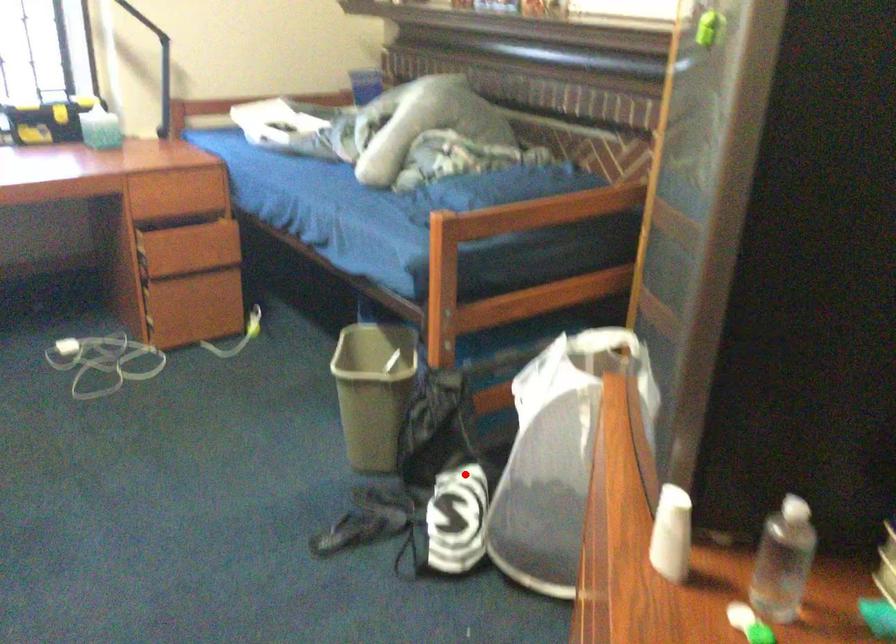
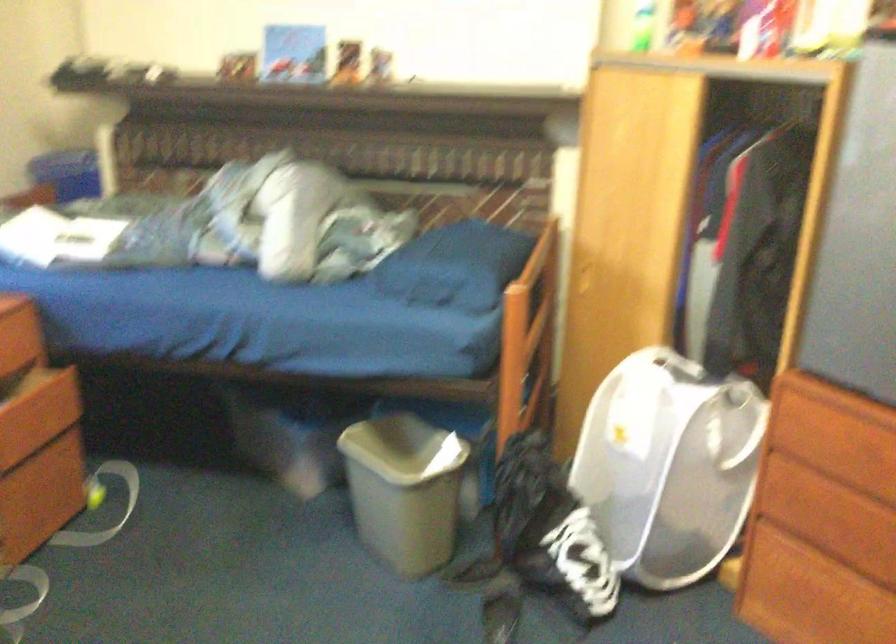
Where in the second image is the point corresponding to the highlighted location from the first image?

(549, 529)